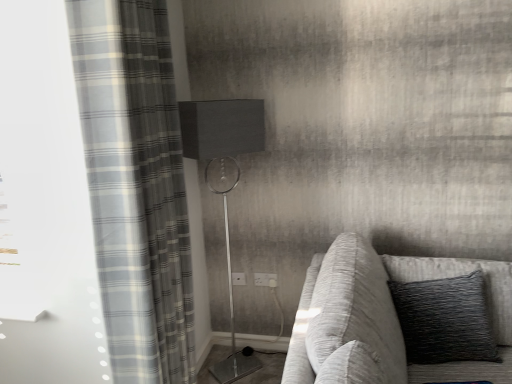
Consider the image. What is the approximate width of textured gray fabric couch at right?

textured gray fabric couch at right is 3.51 feet wide.

The image size is (512, 384). I want to click on textured gray fabric couch at right, so click(x=371, y=312).

The width and height of the screenshot is (512, 384). Identify the location of gray plaid curtain at left. (136, 186).

The height and width of the screenshot is (384, 512). What do you see at coordinates (265, 280) in the screenshot?
I see `white plastic electric outlet at center, the second electric outlet when ordered from left to right` at bounding box center [265, 280].

The image size is (512, 384). What do you see at coordinates (228, 188) in the screenshot?
I see `metallic silver table lamp at center` at bounding box center [228, 188].

You are a GUI agent. You are given a task and a screenshot of the screen. Output one action in this format:
    pyautogui.click(x=<x>, y=<y>)
    Task: Click on the textured gray fabric couch at right
    
    Given the screenshot: What is the action you would take?
    pyautogui.click(x=371, y=312)

Does white plastic electric outlet at center, arranged as the second electric outlet when viewed from the right, have a greater height compared to gray plaid curtain at left?

In fact, white plastic electric outlet at center, arranged as the second electric outlet when viewed from the right, may be shorter than gray plaid curtain at left.

From a real-world perspective, between white plastic electric outlet at center, the first electric outlet viewed from the left, and gray plaid curtain at left, who is vertically lower?

In real-world perspective, white plastic electric outlet at center, the first electric outlet viewed from the left, is lower.

From the image's perspective, is white plastic electric outlet at center, arranged as the second electric outlet when viewed from the right, under gray plaid curtain at left?

Yes, from the image's perspective, white plastic electric outlet at center, arranged as the second electric outlet when viewed from the right, is below gray plaid curtain at left.

Looking at this image, how different are the orientations of white plastic electric outlet at center, arranged as the second electric outlet when viewed from the right, and gray plaid curtain at left in degrees?

The angle between the facing direction of white plastic electric outlet at center, arranged as the second electric outlet when viewed from the right, and the facing direction of gray plaid curtain at left is 86.9 degrees.

From their relative heights in the image, would you say white plastic electric outlet at center, the second electric outlet when ordered from left to right, is taller or shorter than textured gray fabric couch at right?

Clearly, white plastic electric outlet at center, the second electric outlet when ordered from left to right, is shorter compared to textured gray fabric couch at right.

Is white plastic electric outlet at center, the first electric outlet from the right, far from textured gray fabric couch at right?

No, white plastic electric outlet at center, the first electric outlet from the right, is not far away from textured gray fabric couch at right.

Is white plastic electric outlet at center, the first electric outlet from the right, inside or outside of textured gray fabric couch at right?

The correct answer is: outside.

Who is bigger, white plastic electric outlet at center, the first electric outlet from the right, or textured gray fabric couch at right?

textured gray fabric couch at right is bigger.

Is black textured pillow at right inside the boundaries of textured gray fabric couch at right, or outside?

black textured pillow at right lies within the bounds of textured gray fabric couch at right.

Is black textured pillow at right oriented away from textured gray fabric couch at right?

Correct, black textured pillow at right is looking away from textured gray fabric couch at right.

Does black textured pillow at right have a greater height compared to textured gray fabric couch at right?

No.

Is metallic silver table lamp at center beside textured gray fabric couch at right?

No, metallic silver table lamp at center is not making contact with textured gray fabric couch at right.

Is point (250, 146) positioned behind point (416, 365)?

Yes, point (250, 146) is behind point (416, 365).

From the image's perspective, is white plastic electric outlet at center, arranged as the second electric outlet when viewed from the right, located beneath white plastic electric outlet at center, the first electric outlet from the right?

Correct, white plastic electric outlet at center, arranged as the second electric outlet when viewed from the right, appears lower than white plastic electric outlet at center, the first electric outlet from the right, in the image.

From a real-world perspective, is white plastic electric outlet at center, the first electric outlet viewed from the left, above or below white plastic electric outlet at center, the first electric outlet from the right?

white plastic electric outlet at center, the first electric outlet viewed from the left, is situated lower than white plastic electric outlet at center, the first electric outlet from the right, in the real world.

In the scene shown: In the image, is white plastic electric outlet at center, arranged as the second electric outlet when viewed from the right, on the left side or the right side of white plastic electric outlet at center, the second electric outlet when ordered from left to right?

From the image, it's evident that white plastic electric outlet at center, arranged as the second electric outlet when viewed from the right, is to the left of white plastic electric outlet at center, the second electric outlet when ordered from left to right.

Considering the sizes of objects white plastic electric outlet at center, the first electric outlet viewed from the left, and white plastic electric outlet at center, the first electric outlet from the right, in the image provided, who is shorter, white plastic electric outlet at center, the first electric outlet viewed from the left, or white plastic electric outlet at center, the first electric outlet from the right,?

Standing shorter between the two is white plastic electric outlet at center, the first electric outlet viewed from the left.

Is metallic silver table lamp at center directly adjacent to black textured pillow at right?

No, metallic silver table lamp at center is not next to black textured pillow at right.

Consider the image. Considering the relative positions of metallic silver table lamp at center and black textured pillow at right in the image provided, is metallic silver table lamp at center to the left of black textured pillow at right from the viewer's perspective?

Yes.

Is metallic silver table lamp at center outside of black textured pillow at right?

That's correct, metallic silver table lamp at center is outside of black textured pillow at right.

Where is `table lamp positioned vertically above the black textured pillow at right (from a real-world perspective)`? This screenshot has width=512, height=384. table lamp positioned vertically above the black textured pillow at right (from a real-world perspective) is located at coordinates (228, 188).

What's the angular difference between textured gray fabric couch at right and black textured pillow at right's facing directions?

89 degrees.

Is point (343, 383) positioned before point (397, 304)?

Yes, it is.

Does textured gray fabric couch at right appear on the right side of black textured pillow at right?

No, textured gray fabric couch at right is not to the right of black textured pillow at right.

Which object is further away from the camera, textured gray fabric couch at right or black textured pillow at right?

black textured pillow at right is further away from the camera.

The height and width of the screenshot is (384, 512). I want to click on curtain on the left of white plastic electric outlet at center, the first electric outlet viewed from the left, so click(x=136, y=186).

Where is `studio couch that appears below the white plastic electric outlet at center, the first electric outlet from the right (from a real-world perspective)`? The image size is (512, 384). studio couch that appears below the white plastic electric outlet at center, the first electric outlet from the right (from a real-world perspective) is located at coordinates (371, 312).

Which object lies nearer to the anchor point white plastic electric outlet at center, the first electric outlet viewed from the left, textured gray fabric couch at right or white plastic electric outlet at center, the first electric outlet from the right?

Among the two, white plastic electric outlet at center, the first electric outlet from the right, is located nearer to white plastic electric outlet at center, the first electric outlet viewed from the left.

When comparing their distances from metallic silver table lamp at center, does black textured pillow at right or textured gray fabric couch at right seem further?

Among the two, black textured pillow at right is located further to metallic silver table lamp at center.

Estimate the real-world distances between objects in this image. Which object is closer to metallic silver table lamp at center, white plastic electric outlet at center, the first electric outlet from the right, or white plastic electric outlet at center, the first electric outlet viewed from the left?

white plastic electric outlet at center, the first electric outlet viewed from the left, lies closer to metallic silver table lamp at center than the other object.

Considering their positions, is white plastic electric outlet at center, the second electric outlet when ordered from left to right, positioned further to textured gray fabric couch at right than black textured pillow at right?

Among the two, white plastic electric outlet at center, the second electric outlet when ordered from left to right, is located further to textured gray fabric couch at right.

When comparing their distances from gray plaid curtain at left, does textured gray fabric couch at right or black textured pillow at right seem further?

The object further to gray plaid curtain at left is black textured pillow at right.

Considering their positions, is white plastic electric outlet at center, the first electric outlet from the right, positioned closer to metallic silver table lamp at center than textured gray fabric couch at right?

white plastic electric outlet at center, the first electric outlet from the right, is positioned closer to the anchor metallic silver table lamp at center.

Which object lies nearer to the anchor point textured gray fabric couch at right, metallic silver table lamp at center or black textured pillow at right?

black textured pillow at right is positioned closer to the anchor textured gray fabric couch at right.

When comparing their distances from white plastic electric outlet at center, arranged as the second electric outlet when viewed from the right, does white plastic electric outlet at center, the first electric outlet from the right, or gray plaid curtain at left seem closer?

The object closer to white plastic electric outlet at center, arranged as the second electric outlet when viewed from the right, is white plastic electric outlet at center, the first electric outlet from the right.

Where is `table lamp between textured gray fabric couch at right and white plastic electric outlet at center, arranged as the second electric outlet when viewed from the right, in the front-back direction`? table lamp between textured gray fabric couch at right and white plastic electric outlet at center, arranged as the second electric outlet when viewed from the right, in the front-back direction is located at coordinates (228, 188).

Identify the location of pillow between textured gray fabric couch at right and white plastic electric outlet at center, the first electric outlet viewed from the left, in the front-back direction. The image size is (512, 384). (446, 319).

Where is `table lamp between textured gray fabric couch at right and white plastic electric outlet at center, the second electric outlet when ordered from left to right, in the front-back direction`? This screenshot has width=512, height=384. table lamp between textured gray fabric couch at right and white plastic electric outlet at center, the second electric outlet when ordered from left to right, in the front-back direction is located at coordinates (228, 188).

The height and width of the screenshot is (384, 512). What are the coordinates of `electric outlet located between textured gray fabric couch at right and white plastic electric outlet at center, the first electric outlet viewed from the left, in the depth direction` in the screenshot? It's located at (265, 280).